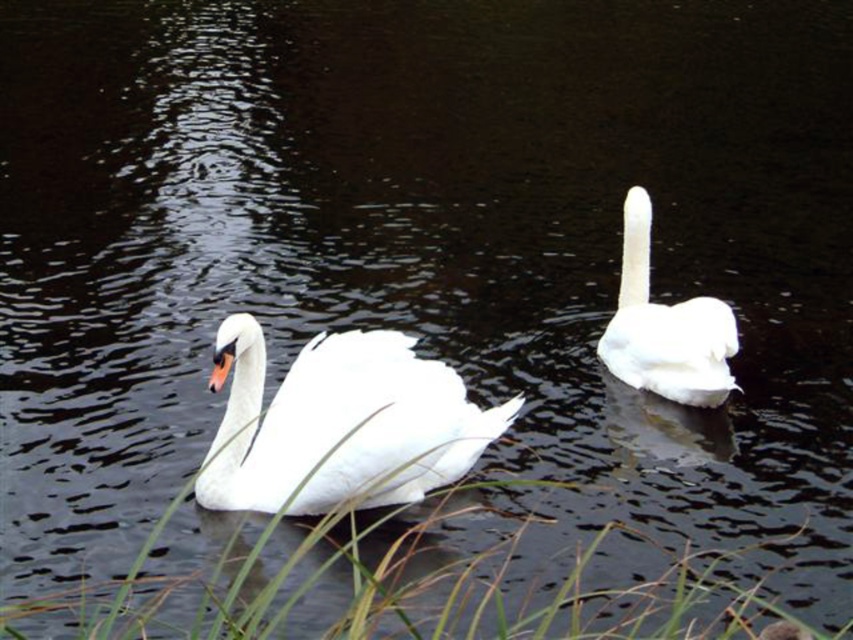
Question: Does white glossy swan at center lie in front of white feathered swan at right?

Choices:
 (A) yes
 (B) no

Answer: (A)

Question: In this image, where is white glossy swan at center located relative to white feathered swan at right?

Choices:
 (A) left
 (B) right

Answer: (A)

Question: Is white glossy swan at center thinner than white feathered swan at right?

Choices:
 (A) yes
 (B) no

Answer: (B)

Question: Which point appears farthest from the camera in this image?

Choices:
 (A) (231, 484)
 (B) (654, 376)

Answer: (B)